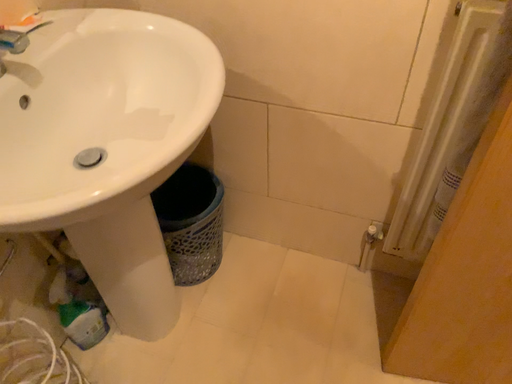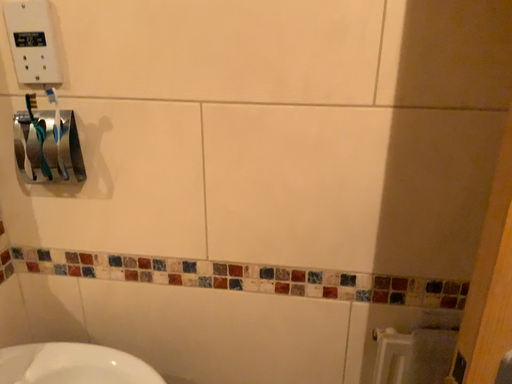
Question: How did the camera likely rotate when shooting the video?

Choices:
 (A) rotated right
 (B) rotated left

Answer: (A)